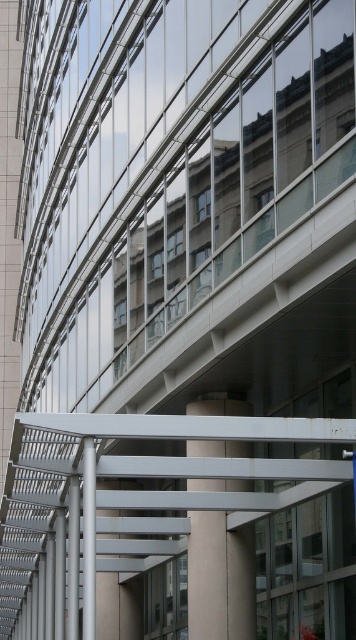
Can you confirm if white matte pillar at center is shorter than silver metallic pole at center?

Correct, white matte pillar at center is not as tall as silver metallic pole at center.

Who is positioned more to the left, white matte pillar at center or silver metallic pole at center?

silver metallic pole at center

Image resolution: width=356 pixels, height=640 pixels. What are the coordinates of `white matte pillar at center` in the screenshot? It's located at (220, 579).